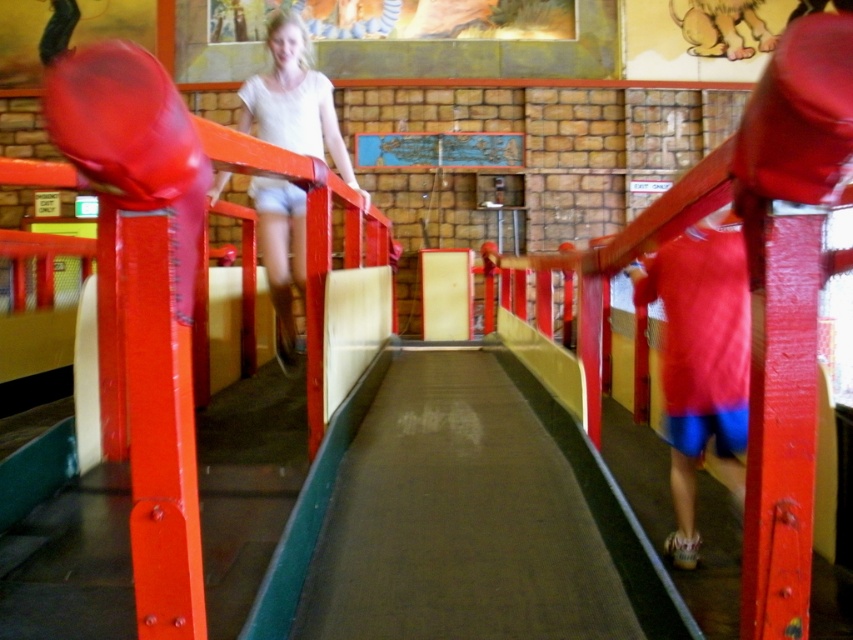
Who is positioned more to the left, red fabric shorts at center or white matte shorts at upper center?

From the viewer's perspective, white matte shorts at upper center appears more on the left side.

This screenshot has height=640, width=853. What do you see at coordinates (700, 360) in the screenshot?
I see `red fabric shorts at center` at bounding box center [700, 360].

Is point (746, 320) closer to viewer compared to point (277, 276)?

Yes, it is.

Identify the location of red fabric shorts at center. The image size is (853, 640). (700, 360).